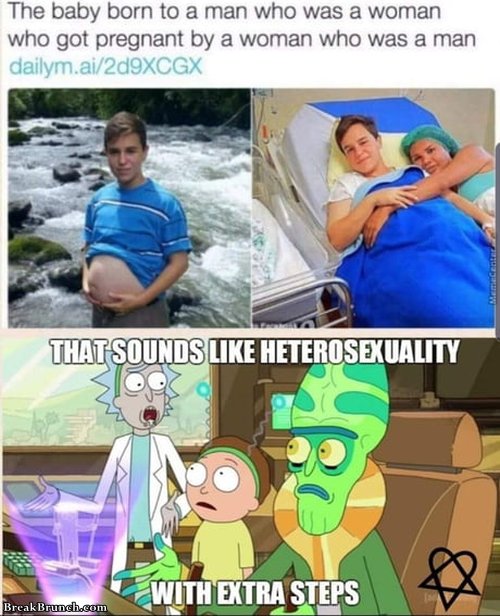
At what (x,y) coordinates should I click in order to perform the action: click on blanket. Please return your answer as a coordinate pair (x, y). Looking at the image, I should click on (423, 268).